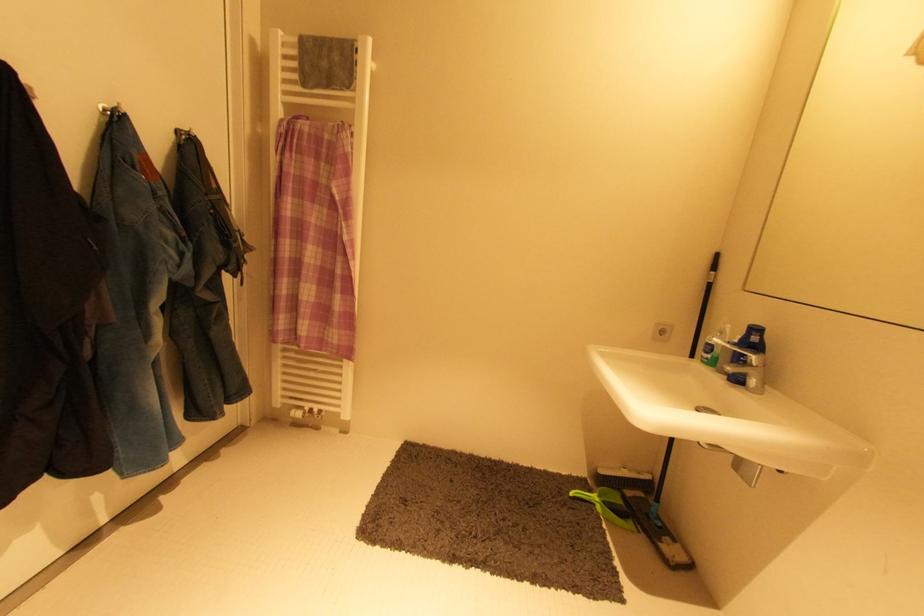
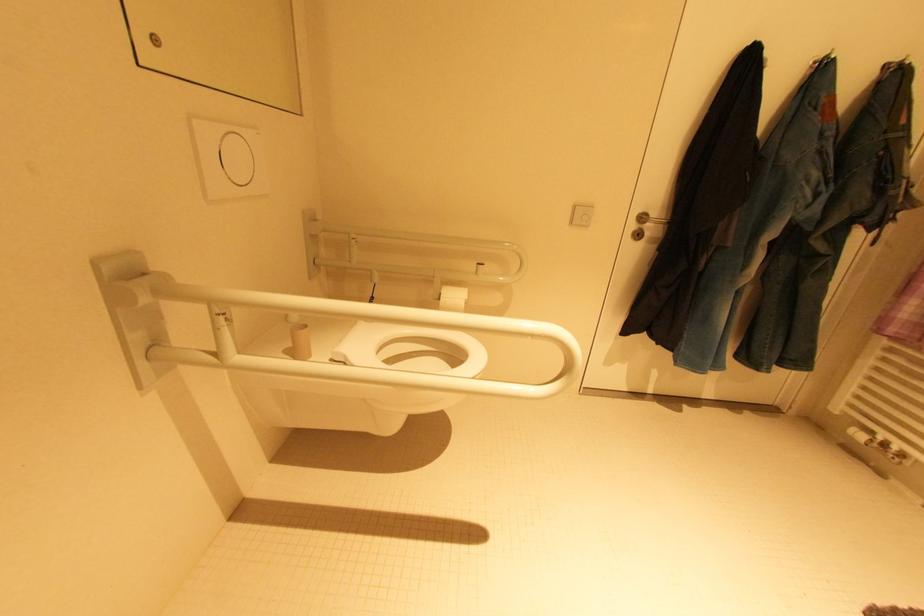
Question: The camera is either moving clockwise (left) or counter-clockwise (right) around the object. The first image is from the beginning of the video and the second image is from the end. Is the camera moving left or right when shooting the video?

Choices:
 (A) Left
 (B) Right

Answer: (B)